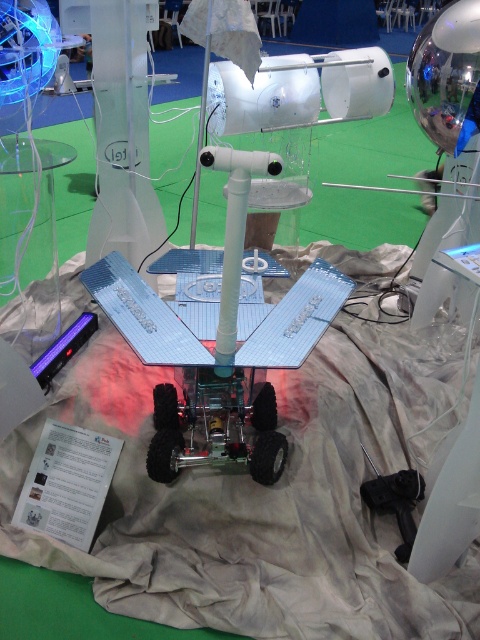
Question: Is white fabric at center smaller than transparent glass table at left?

Choices:
 (A) yes
 (B) no

Answer: (B)

Question: Does white fabric at center have a lesser width compared to transparent glass table at left?

Choices:
 (A) yes
 (B) no

Answer: (B)

Question: In this image, where is white fabric at center located relative to transparent glass table at left?

Choices:
 (A) right
 (B) left

Answer: (A)

Question: Which point is closer to the camera taking this photo?

Choices:
 (A) (35, 177)
 (B) (111, 330)

Answer: (B)

Question: Which point is farther from the camera taking this photo?

Choices:
 (A) (199, 508)
 (B) (44, 148)

Answer: (B)

Question: Which of the following is the farthest from the observer?

Choices:
 (A) (49, 186)
 (B) (279, 256)

Answer: (B)